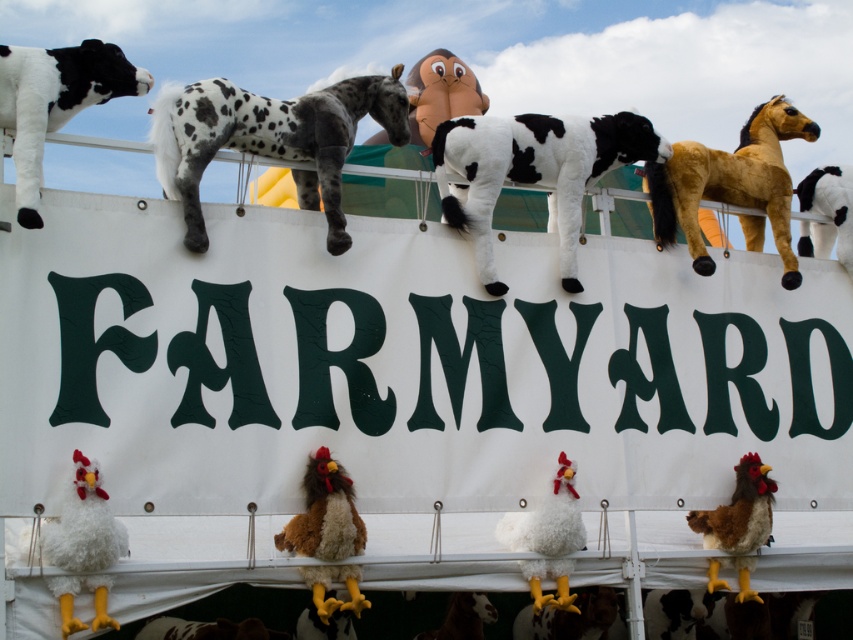
Question: Does brown fuzzy chicken at center have a larger size compared to white fluffy chicken at lower center?

Choices:
 (A) yes
 (B) no

Answer: (B)

Question: Does brown plush horse at upper right have a larger size compared to brown fuzzy chicken at lower right?

Choices:
 (A) no
 (B) yes

Answer: (B)

Question: Can you confirm if brown plush horse at upper right is bigger than white fluffy chicken at lower center?

Choices:
 (A) yes
 (B) no

Answer: (A)

Question: Which object is farther from the camera taking this photo?

Choices:
 (A) brown plush horse at upper right
 (B) white fluffy chicken at lower left
 (C) brown fuzzy chicken at center
 (D) black and white plush cow at upper left

Answer: (A)

Question: Which is farther from the black and white plush cow at upper left?

Choices:
 (A) white fluffy chicken at lower center
 (B) white fluffy chicken at lower left
 (C) soft plush cow at center

Answer: (A)

Question: Which object is positioned closest to the white fluffy chicken at lower left?

Choices:
 (A) brown plush horse at upper right
 (B) soft plush cow at center
 (C) black and white plush cow at upper left

Answer: (C)